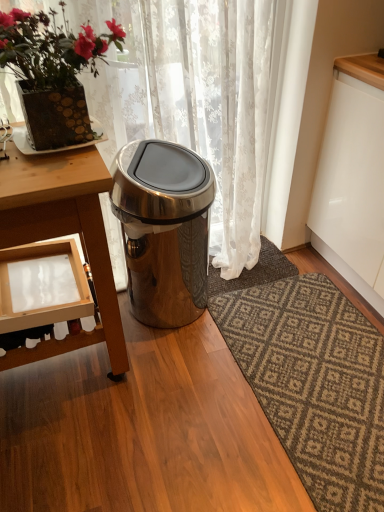
Where is `dark gray textured rug at center`? This screenshot has height=512, width=384. dark gray textured rug at center is located at coordinates (253, 271).

The height and width of the screenshot is (512, 384). What do you see at coordinates (312, 381) in the screenshot?
I see `dark brown textured rug at lower right` at bounding box center [312, 381].

Measure the distance between point (33, 174) and camera.

A distance of 3.56 feet exists between point (33, 174) and camera.

Locate an element on the screen. white lace curtain at upper center is located at coordinates (203, 102).

Locate an element on the screen. The width and height of the screenshot is (384, 512). curtain located above the dark brown textured rug at lower right (from a real-world perspective) is located at coordinates (203, 102).

Is white lace curtain at upper center beside dark brown textured rug at lower right?

white lace curtain at upper center is not next to dark brown textured rug at lower right, and they're not touching.

Would you say matte gold pot at upper left contains white lace curtain at upper center?

Definitely not — white lace curtain at upper center is not inside matte gold pot at upper left.

How far apart are matte gold pot at upper left and white lace curtain at upper center?

They are 20.34 inches apart.

From the image's perspective, which one is positioned lower, matte gold pot at upper left or white lace curtain at upper center?

white lace curtain at upper center is shown below in the image.

Are matte gold pot at upper left and white lace curtain at upper center far apart?

No.

Image resolution: width=384 pixels, height=512 pixels. Identify the location of mat located behind the matte gold pot at upper left. (312, 381).

Is matte gold pot at upper left smaller than dark brown textured rug at lower right?

Actually, matte gold pot at upper left might be larger than dark brown textured rug at lower right.

From the image's perspective, is matte gold pot at upper left on dark brown textured rug at lower right?

Yes, from the image's perspective, matte gold pot at upper left is above dark brown textured rug at lower right.

What's the angular difference between white lace curtain at upper center and wooden table at left's facing directions?

white lace curtain at upper center and wooden table at left are facing 2.73 degrees away from each other.

Is white lace curtain at upper center next to wooden table at left and touching it?

No, white lace curtain at upper center is not making contact with wooden table at left.

Is white lace curtain at upper center at the left side of wooden table at left?

In fact, white lace curtain at upper center is to the right of wooden table at left.

Can you confirm if white lace curtain at upper center is shorter than wooden table at left?

No.

Does dark gray textured rug at center touch matte gold pot at upper left?

No, dark gray textured rug at center is not touching matte gold pot at upper left.

Considering the positions of objects dark gray textured rug at center and matte gold pot at upper left in the image provided, who is in front, dark gray textured rug at center or matte gold pot at upper left?

Positioned in front is matte gold pot at upper left.

Where is `houseplant in front of the dark gray textured rug at center`? The width and height of the screenshot is (384, 512). houseplant in front of the dark gray textured rug at center is located at coordinates (53, 73).

From the image's perspective, which one is positioned lower, dark gray textured rug at center or matte gold pot at upper left?

dark gray textured rug at center, from the image's perspective.

Is satin silver trash can at center positioned before dark brown textured rug at lower right?

No, it is behind dark brown textured rug at lower right.

From the image's perspective, is satin silver trash can at center located beneath dark brown textured rug at lower right?

No.

Is satin silver trash can at center bigger than dark brown textured rug at lower right?

Yes, satin silver trash can at center is bigger than dark brown textured rug at lower right.

Find the location of a particular element. The image size is (384, 512). mat lying in front of the satin silver trash can at center is located at coordinates (312, 381).

Considering the sizes of dark brown textured rug at lower right and satin silver trash can at center in the image, is dark brown textured rug at lower right taller or shorter than satin silver trash can at center?

dark brown textured rug at lower right is shorter than satin silver trash can at center.

Looking at this image, is dark brown textured rug at lower right turned away from satin silver trash can at center?

That's not correct — dark brown textured rug at lower right is not looking away from satin silver trash can at center.

Are dark brown textured rug at lower right and satin silver trash can at center located far from each other?

Actually, dark brown textured rug at lower right and satin silver trash can at center are a little close together.

You are a GUI agent. You are given a task and a screenshot of the screen. Output one action in this format:
    pyautogui.click(x=<x>, y=<y>)
    Task: Click on the curtain located in front of the dark brown textured rug at lower right
    The width and height of the screenshot is (384, 512).
    Given the screenshot: What is the action you would take?
    pyautogui.click(x=203, y=102)

Locate an element on the screen. houseplant above the white lace curtain at upper center (from a real-world perspective) is located at coordinates (53, 73).

From the image, which object appears to be nearer to wooden table at left, white lace curtain at upper center or matte gold pot at upper left?

matte gold pot at upper left is positioned closer to the anchor wooden table at left.

From the image, which object appears to be nearer to dark gray textured rug at center, wooden table at left or satin silver trash can at center?

satin silver trash can at center is closer to dark gray textured rug at center.

From the image, which object appears to be farther from wooden table at left, dark brown textured rug at lower right or white lace curtain at upper center?

The object further to wooden table at left is dark brown textured rug at lower right.

Based on their spatial positions, is dark brown textured rug at lower right or satin silver trash can at center closer to matte gold pot at upper left?

The object closer to matte gold pot at upper left is satin silver trash can at center.

From the image, which object appears to be nearer to dark brown textured rug at lower right, satin silver trash can at center or wooden table at left?

satin silver trash can at center.

Which object lies further to the anchor point wooden table at left, white lace curtain at upper center or dark gray textured rug at center?

dark gray textured rug at center.

Looking at the image, which one is located closer to satin silver trash can at center, matte gold pot at upper left or wooden table at left?

wooden table at left.

Based on their spatial positions, is dark brown textured rug at lower right or white lace curtain at upper center closer to dark gray textured rug at center?

dark brown textured rug at lower right lies closer to dark gray textured rug at center than the other object.

Locate an element on the screen. Image resolution: width=384 pixels, height=512 pixels. curtain between matte gold pot at upper left and dark brown textured rug at lower right in the up-down direction is located at coordinates (203, 102).

I want to click on houseplant between wooden table at left and dark brown textured rug at lower right, so click(53, 73).

The width and height of the screenshot is (384, 512). I want to click on trash bin/can located between wooden table at left and dark brown textured rug at lower right in the left-right direction, so tap(164, 229).

You are a GUI agent. You are given a task and a screenshot of the screen. Output one action in this format:
    pyautogui.click(x=<x>, y=<y>)
    Task: Click on the mat between matte gold pot at upper left and dark gray textured rug at center along the z-axis
    
    Given the screenshot: What is the action you would take?
    pyautogui.click(x=312, y=381)